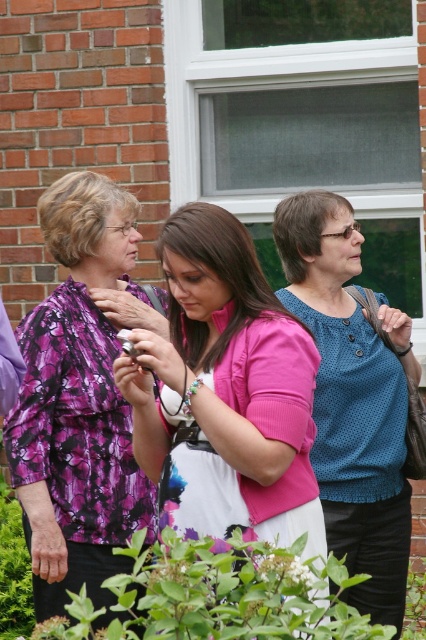
Question: Is pink matte shirt at center below blue dotted blouse at center?

Choices:
 (A) no
 (B) yes

Answer: (A)

Question: Which point is farther to the camera?

Choices:
 (A) blue dotted blouse at center
 (B) purple floral blouse at left
 (C) pink matte shirt at center

Answer: (A)

Question: Is pink matte shirt at center below purple floral blouse at left?

Choices:
 (A) yes
 (B) no

Answer: (B)

Question: Which object is closer to the camera taking this photo?

Choices:
 (A) blue dotted blouse at center
 (B) purple floral blouse at left

Answer: (B)

Question: Among these points, which one is nearest to the camera?

Choices:
 (A) (192, 339)
 (B) (374, 436)

Answer: (A)

Question: Is purple floral blouse at left wider than blue dotted blouse at center?

Choices:
 (A) yes
 (B) no

Answer: (A)